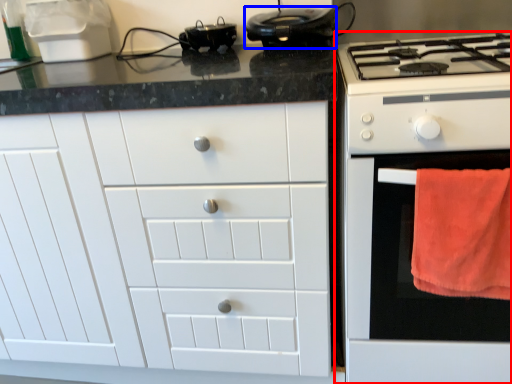
Question: Which object is closer to the camera taking this photo, home appliance (highlighted by a red box) or kitchen appliance (highlighted by a blue box)?

Choices:
 (A) home appliance
 (B) kitchen appliance

Answer: (A)